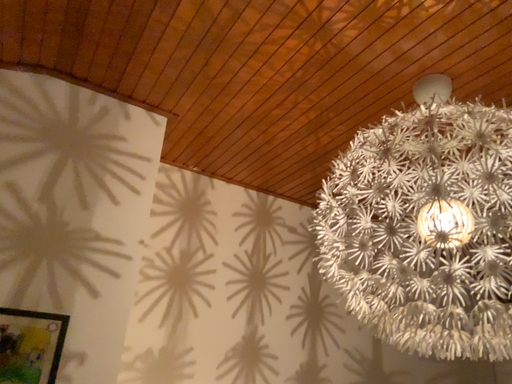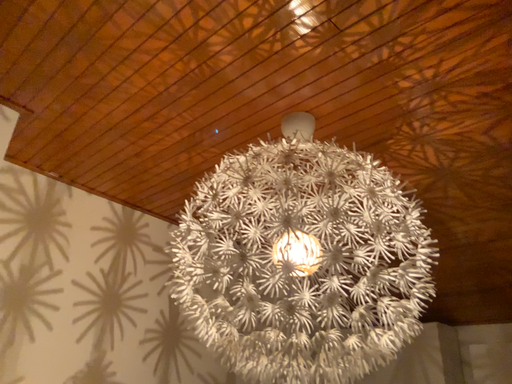
Question: How did the camera likely rotate when shooting the video?

Choices:
 (A) rotated left
 (B) rotated right

Answer: (B)